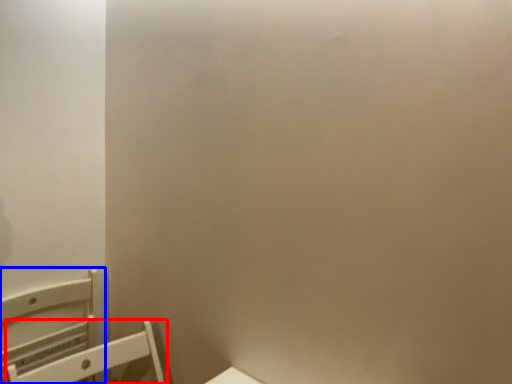
Question: Which object is closer to the camera taking this photo, furniture (highlighted by a red box) or furniture (highlighted by a blue box)?

Choices:
 (A) furniture
 (B) furniture

Answer: (A)